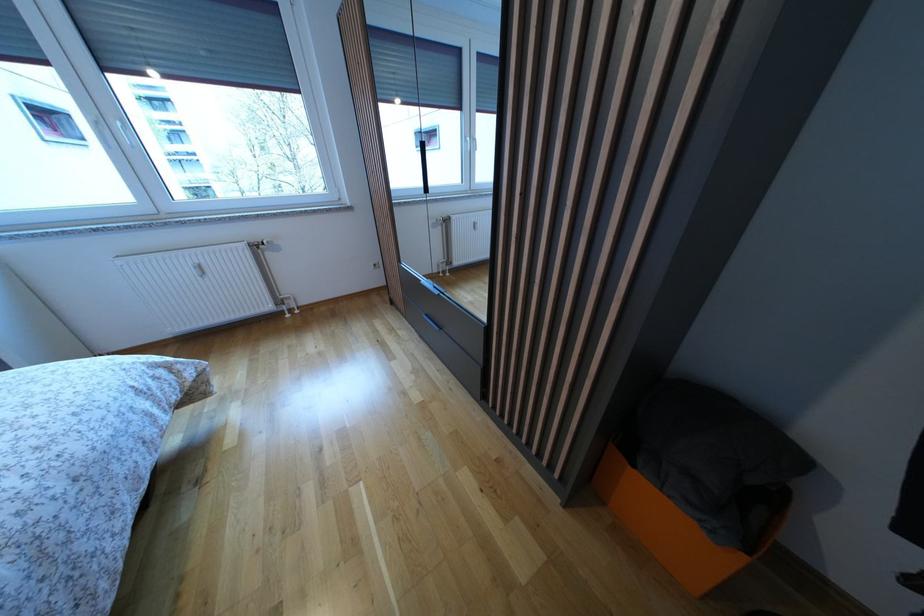
Locate an element on the screen. This screenshot has width=924, height=616. grey drawer handle is located at coordinates (431, 323).